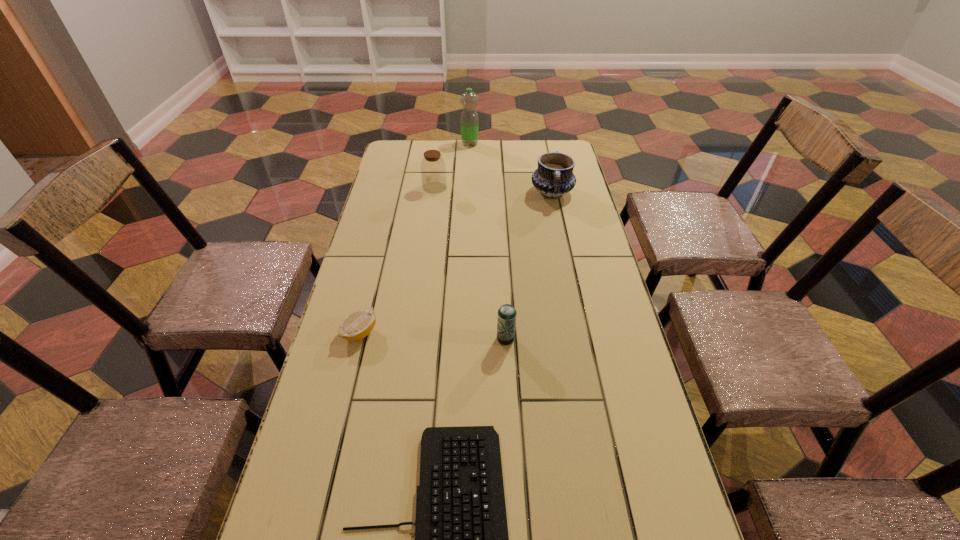
Find the location of a particular element. The width and height of the screenshot is (960, 540). vacant region that satisfies the following two spatial constraints: 1. on the back side of the leftmost object; 2. on the left side of the rightmost object is located at coordinates (395, 193).